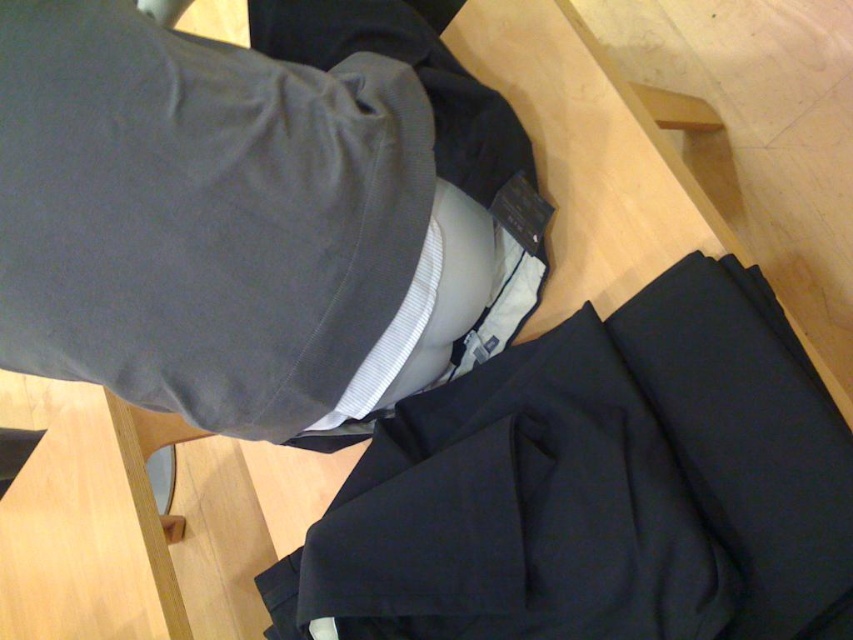
Describe the element at coordinates (598, 486) in the screenshot. The image size is (853, 640). I see `navy blue fabric pants at center` at that location.

Which of these two, navy blue fabric pants at center or dark gray fabric jacket at upper center, stands taller?

navy blue fabric pants at center is taller.

Does point (734, 262) come in front of point (135, 301)?

No, it is behind (135, 301).

Find the location of a particular element. navy blue fabric pants at center is located at coordinates (598, 486).